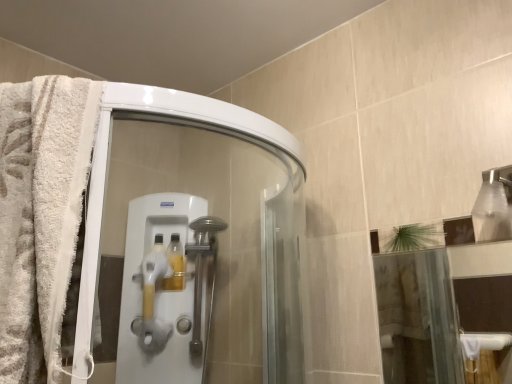
What is the approximate height of white fluffy towel at left?

It is 47.70 centimeters.

Measure the distance between white fluffy towel at left and camera.

The distance of white fluffy towel at left from camera is 21.20 inches.

In order to click on white fluffy towel at left in this screenshot , I will do `click(40, 214)`.

What do you see at coordinates (40, 214) in the screenshot? I see `white fluffy towel at left` at bounding box center [40, 214].

Locate an element on the screen. The width and height of the screenshot is (512, 384). white fluffy towel at left is located at coordinates (40, 214).